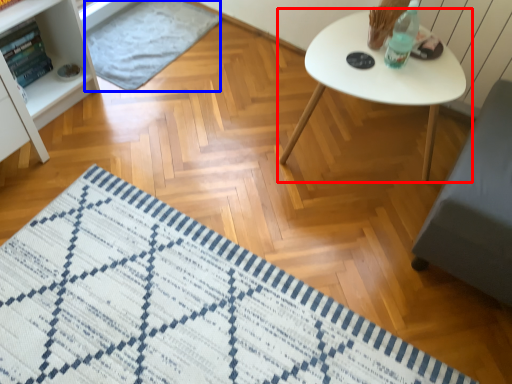
Question: Among these objects, which one is farthest to the camera, table (highlighted by a red box) or mat (highlighted by a blue box)?

Choices:
 (A) table
 (B) mat

Answer: (B)